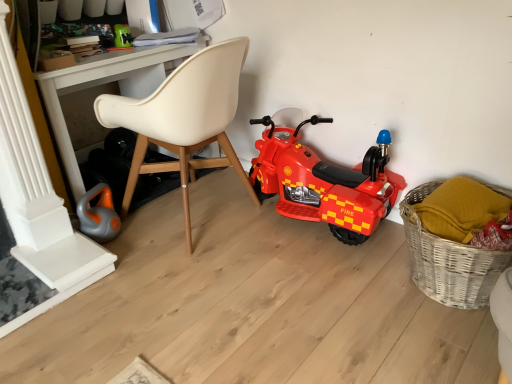
The image size is (512, 384). In order to click on free spot to the right of orange rubber toy at lower left, positioned as the second toy in top-to-bottom order in this screenshot , I will do click(x=147, y=233).